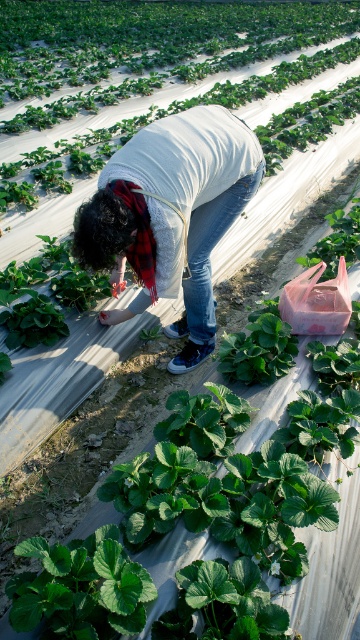
Between point (271, 20) and point (96, 572), which one is positioned behind?

The point (271, 20) is behind.

Does green leafy plant at center appear on the left side of green leafy plant at lower left?

Correct, you'll find green leafy plant at center to the left of green leafy plant at lower left.

The height and width of the screenshot is (640, 360). In order to click on green leafy plant at center in this screenshot , I will do `click(144, 45)`.

Which is more to the right, green leafy plant at lower left or pink plastic bucket at center-right?

Positioned to the right is pink plastic bucket at center-right.

Can you confirm if green leafy plant at lower left is smaller than pink plastic bucket at center-right?

Correct, green leafy plant at lower left occupies less space than pink plastic bucket at center-right.

Is point (149, 596) in front of point (347, 230)?

Yes, point (149, 596) is closer to viewer.

This screenshot has height=640, width=360. I want to click on green leafy plant at lower left, so (x=81, y=588).

Which is in front, point (240, 144) or point (146, 68)?

Point (240, 144)

Is denim jeans at center to the left of green leafy plant at center from the viewer's perspective?

Incorrect, denim jeans at center is not on the left side of green leafy plant at center.

Which is in front, point (164, 157) or point (33, 26)?

Point (164, 157)

Image resolution: width=360 pixels, height=640 pixels. I want to click on denim jeans at center, so click(x=171, y=216).